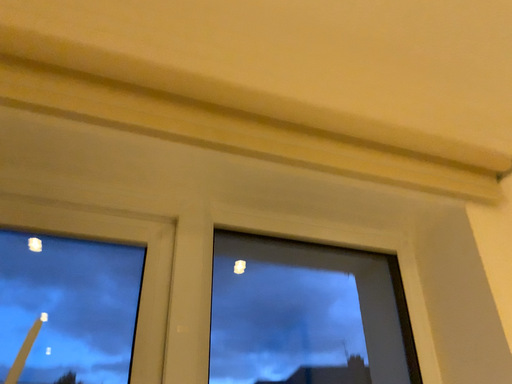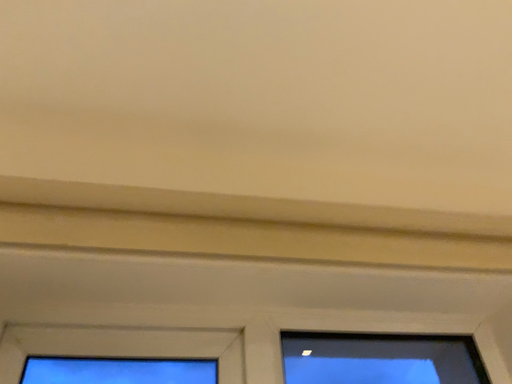
Question: How did the camera likely rotate when shooting the video?

Choices:
 (A) rotated left
 (B) rotated right

Answer: (A)